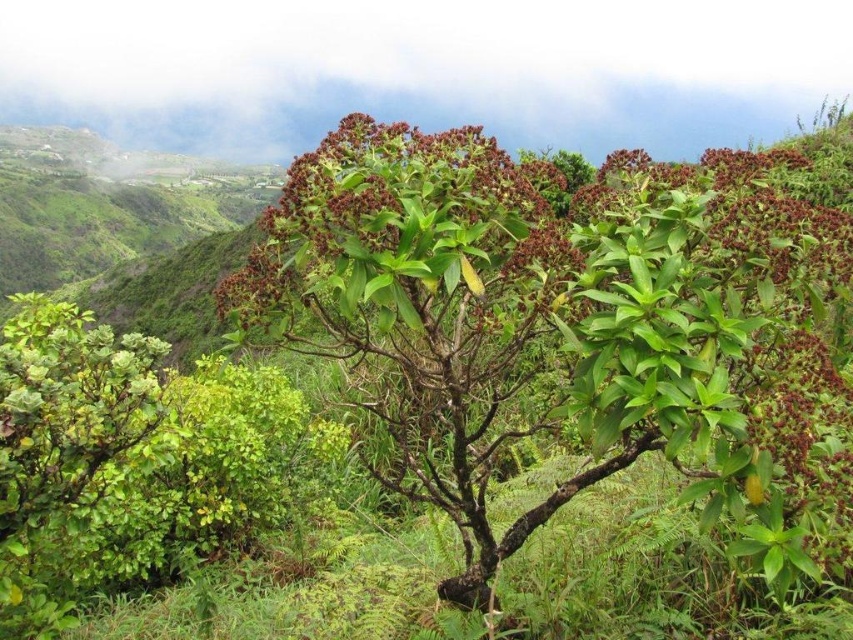
Consider the image. You are a hiker who needs to place a 10 feet long wooden bench between the green leafy shrub at center and the brown matte flower at center. Is there enough space to place the bench without moving either object?

The green leafy shrub at center is 16.30 feet away from the brown matte flower at center. Since the bench is only 10 feet long, there is sufficient space to place it between them without moving either object.

You are a gardener standing in the valley and want to water both the green leafy shrub at center and the brown matte flower at center. Which one should you water first if you want to start with the one closer to you?

You should water the green leafy shrub at center first because it is closer to you than the brown matte flower at center.